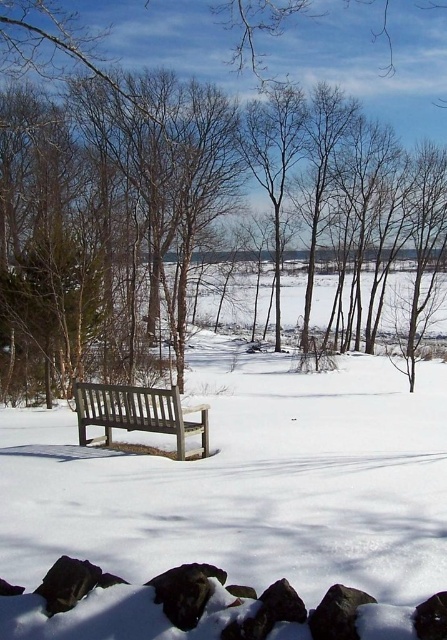
Is point (0, 230) behind point (42, 632)?

Yes, point (0, 230) is behind point (42, 632).

Who is more forward, (x=140, y=237) or (x=379, y=515)?

Point (x=379, y=515)

This screenshot has width=447, height=640. Find the location of `brown wood bench at lower left`. brown wood bench at lower left is located at coordinates (181, 198).

Who is more forward, (19,252) or (156,428)?

Point (156,428)

Does brown wood bench at lower left have a smaller size compared to wooden bench at center?

No, brown wood bench at lower left is not smaller than wooden bench at center.

Who is more distant from viewer, (231, 116) or (80, 403)?

Positioned behind is point (231, 116).

Locate an element on the screen. The image size is (447, 640). brown wood bench at lower left is located at coordinates (181, 198).

Who is positioned more to the left, white matte bench at center or wooden bench at center?

Positioned to the left is wooden bench at center.

Is white matte bench at center to the left of wooden bench at center from the viewer's perspective?

Incorrect, white matte bench at center is not on the left side of wooden bench at center.

Locate an element on the screen. This screenshot has width=447, height=640. white matte bench at center is located at coordinates (237, 499).